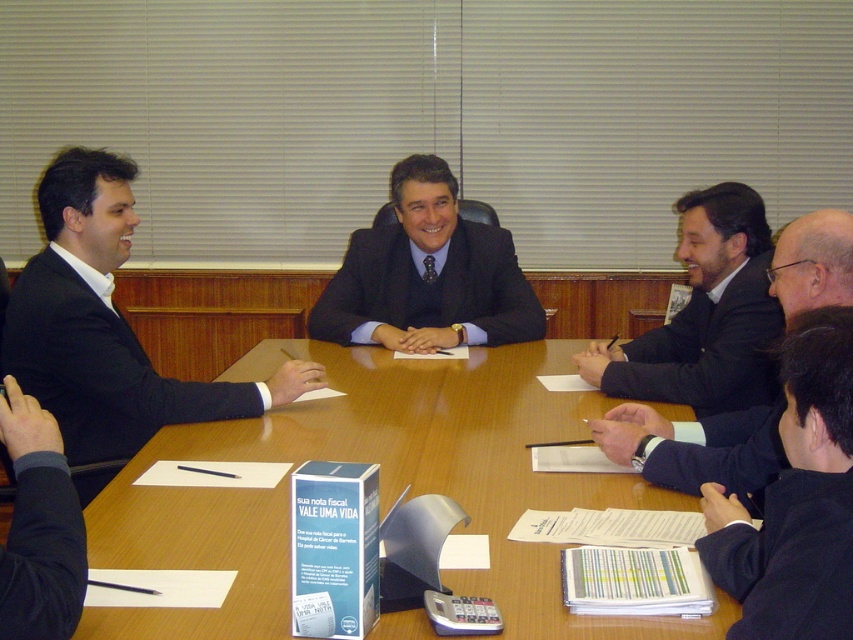
Question: Considering the real-world distances, which object is farthest from the dark blue fabric business suit at lower right?

Choices:
 (A) black suit at right
 (B) black matte suit at lower right
 (C) matte black suit at center
 (D) wooden table at center

Answer: (C)

Question: Observing the image, what is the correct spatial positioning of black suit at right in reference to black matte suit at lower right?

Choices:
 (A) left
 (B) right

Answer: (A)

Question: Among these objects, which one is farthest from the camera?

Choices:
 (A) wooden table at center
 (B) matte black suit at center
 (C) black matte suit at lower right
 (D) dark blue fabric business suit at lower right

Answer: (B)

Question: Based on their relative distances, which object is nearer to the dark blue fabric business suit at lower right?

Choices:
 (A) matte black suit at center
 (B) wooden table at center
 (C) black matte suit at lower right
 (D) black suit at right

Answer: (D)

Question: Can you confirm if black suit at right is bigger than matte black suit at center?

Choices:
 (A) no
 (B) yes

Answer: (A)

Question: Can you confirm if matte black suit at center is positioned below black matte suit at lower right?

Choices:
 (A) no
 (B) yes

Answer: (A)